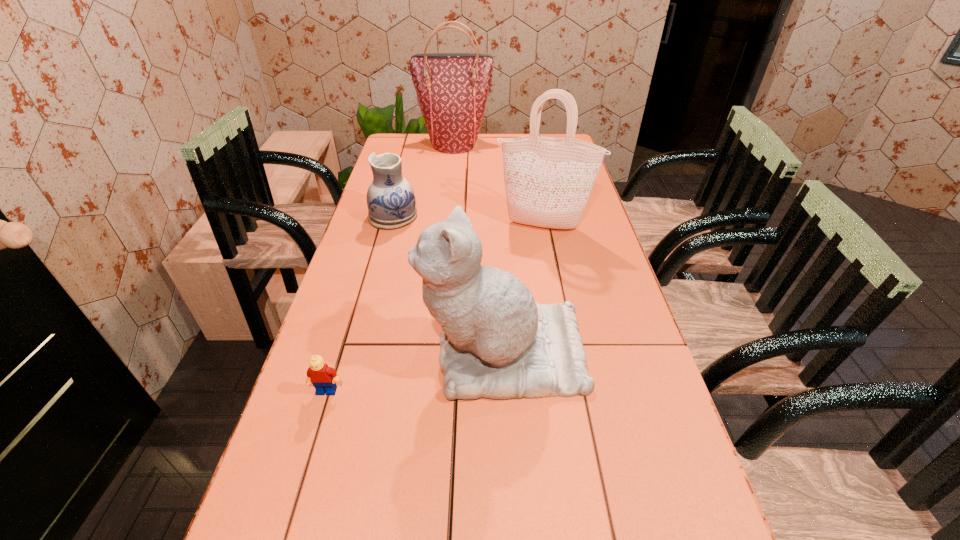
The width and height of the screenshot is (960, 540). In the image, there is a desktop. What are the coordinates of `vacant space at the left edge` in the screenshot? It's located at (379, 341).

The height and width of the screenshot is (540, 960). In order to click on free spot at the right edge of the desktop in this screenshot , I will do `click(696, 511)`.

Locate an element on the screen. vacant region between the cat and the Lego is located at coordinates (415, 372).

Find the location of a particular element. free point between the farthest object and the pottery is located at coordinates (424, 180).

You are a GUI agent. You are given a task and a screenshot of the screen. Output one action in this format:
    pyautogui.click(x=<x>, y=<y>)
    Task: Click on the vacant point located between the pottery and the Lego
    Image resolution: width=960 pixels, height=540 pixels.
    Given the screenshot: What is the action you would take?
    pyautogui.click(x=360, y=303)

This screenshot has width=960, height=540. Find the location of `object that stands as the fourth closest to the shopping bag`. object that stands as the fourth closest to the shopping bag is located at coordinates (323, 378).

At what (x,y) coordinates should I click in order to perform the action: click on object that ranks as the closest to the handbag. Please return your answer as a coordinate pair (x, y). Image resolution: width=960 pixels, height=540 pixels. Looking at the image, I should click on (391, 202).